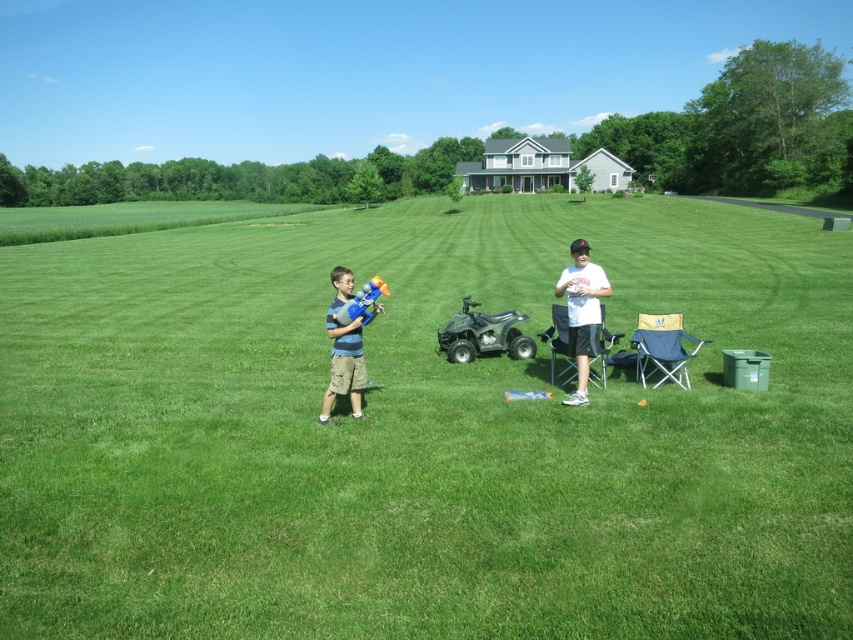
Question: Is green grass at center to the right of white matte t-shirt at center from the viewer's perspective?

Choices:
 (A) no
 (B) yes

Answer: (A)

Question: Which point is closer to the camera?

Choices:
 (A) (758, 218)
 (B) (577, 280)

Answer: (B)

Question: Can you confirm if green grass at center is positioned above white matte t-shirt at center?

Choices:
 (A) yes
 (B) no

Answer: (A)

Question: Which point is closer to the camera?

Choices:
 (A) white matte t-shirt at center
 (B) green grass at center

Answer: (B)

Question: Is green grass at center smaller than white matte t-shirt at center?

Choices:
 (A) no
 (B) yes

Answer: (A)